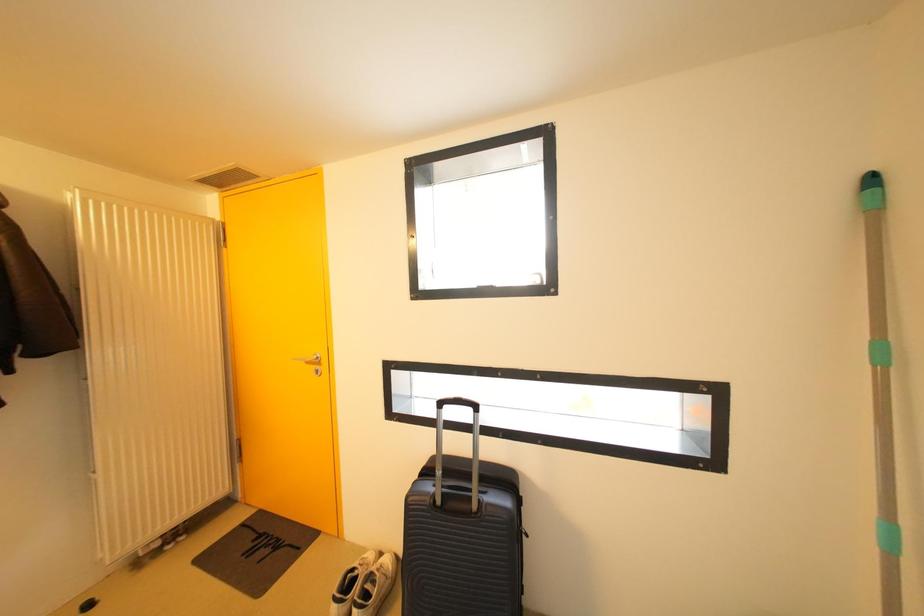
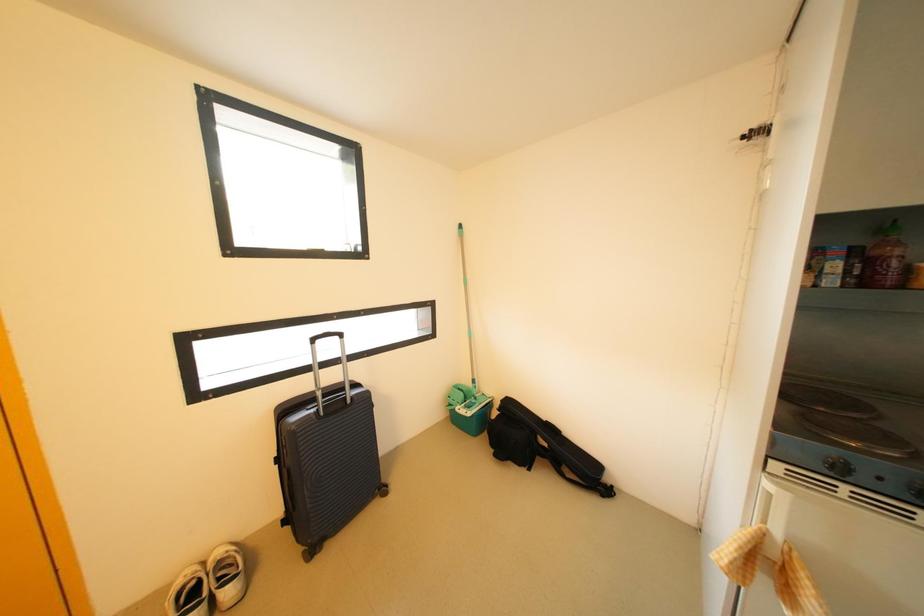
Question: The first image is from the beginning of the video and the second image is from the end. How did the camera likely rotate when shooting the video?

Choices:
 (A) Left
 (B) Right
 (C) Up
 (D) Down

Answer: (B)